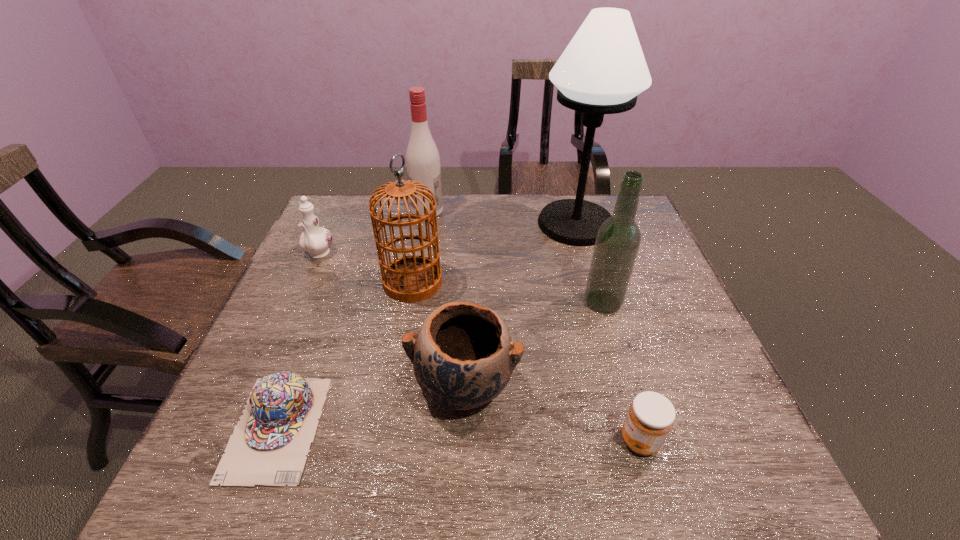
At what (x,y) coordinates should I click in order to perform the action: click on cap present at the near edge. Please return your answer as a coordinate pair (x, y). The image size is (960, 540). Looking at the image, I should click on (268, 447).

Image resolution: width=960 pixels, height=540 pixels. I want to click on chinaware present at the left edge, so click(x=315, y=240).

Locate an element on the screen. The height and width of the screenshot is (540, 960). cap present at the left edge is located at coordinates (268, 447).

Where is `table lamp positioned at the right edge`? The height and width of the screenshot is (540, 960). table lamp positioned at the right edge is located at coordinates (602, 70).

Where is `liquor present at the right edge`? liquor present at the right edge is located at coordinates (618, 239).

Locate an element on the screen. object situated at the near left corner is located at coordinates (268, 447).

Image resolution: width=960 pixels, height=540 pixels. Identify the location of object positioned at the far right corner. (602, 70).

The height and width of the screenshot is (540, 960). In order to click on vacant region at the far edge in this screenshot , I will do `click(422, 225)`.

The image size is (960, 540). I want to click on free region at the near edge of the desktop, so click(x=369, y=463).

Identify the location of free region at the left edge of the desktop. [335, 278].